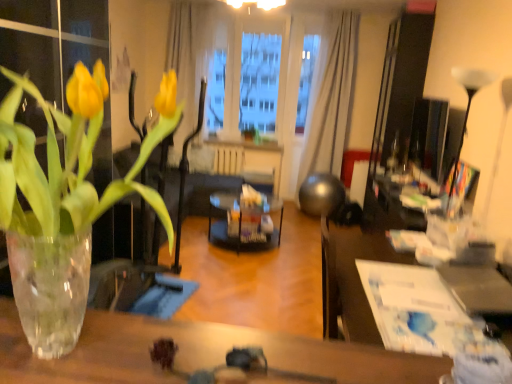
Question: Can you confirm if black glass table at center is smaller than translucent glass vase at left?

Choices:
 (A) no
 (B) yes

Answer: (A)

Question: Can you confirm if black glass table at center is bigger than translucent glass vase at left?

Choices:
 (A) yes
 (B) no

Answer: (A)

Question: From the image's perspective, does black glass table at center appear lower than translucent glass vase at left?

Choices:
 (A) yes
 (B) no

Answer: (A)

Question: From the image's perspective, does black glass table at center appear higher than translucent glass vase at left?

Choices:
 (A) no
 (B) yes

Answer: (A)

Question: Is black glass table at center not near translucent glass vase at left?

Choices:
 (A) yes
 (B) no

Answer: (A)

Question: Considering the relative sizes of black glass table at center and translucent glass vase at left in the image provided, is black glass table at center thinner than translucent glass vase at left?

Choices:
 (A) yes
 (B) no

Answer: (B)

Question: From the image's perspective, is transparent plastic window screen at center above white sheer curtain at upper center?

Choices:
 (A) yes
 (B) no

Answer: (A)

Question: Is transparent plastic window screen at center further to camera compared to white sheer curtain at upper center?

Choices:
 (A) yes
 (B) no

Answer: (A)

Question: From a real-world perspective, is transparent plastic window screen at center located higher than white sheer curtain at upper center?

Choices:
 (A) no
 (B) yes

Answer: (B)

Question: Is transparent plastic window screen at center touching white sheer curtain at upper center?

Choices:
 (A) yes
 (B) no

Answer: (B)

Question: Does transparent plastic window screen at center lie in front of white sheer curtain at upper center?

Choices:
 (A) no
 (B) yes

Answer: (A)

Question: Is transparent plastic window screen at center to the left of white sheer curtain at upper center from the viewer's perspective?

Choices:
 (A) yes
 (B) no

Answer: (A)

Question: From a real-world perspective, is white paper at center, arranged as the second table when viewed from the front, positioned over white glossy lamp at upper right based on gravity?

Choices:
 (A) yes
 (B) no

Answer: (B)